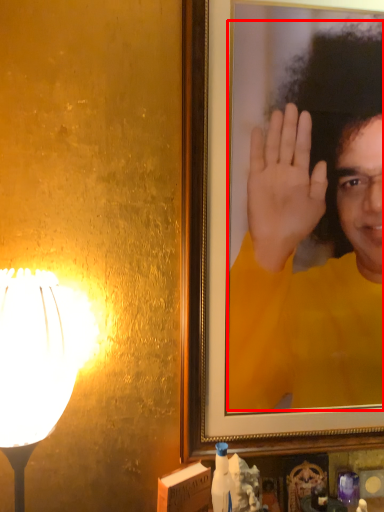
Question: From the image's perspective, where is man (annotated by the red box) located in relation to lamp in the image?

Choices:
 (A) above
 (B) below

Answer: (A)